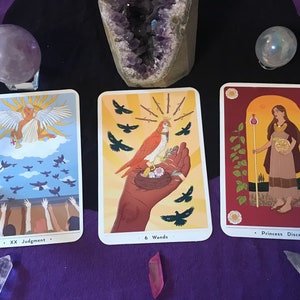
At what (x,y) coordinates should I click in order to perform the action: click on plastic crystal stand. Please return your answer as a coordinate pair (x, y). This screenshot has height=300, width=300. Looking at the image, I should click on (29, 85), (264, 66).